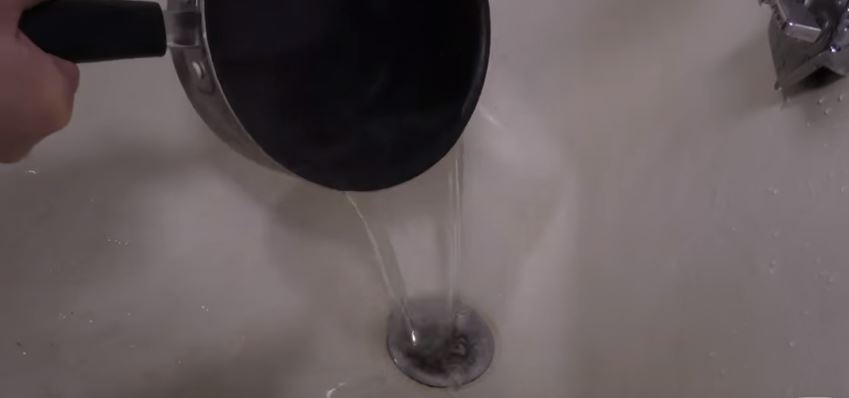
The height and width of the screenshot is (398, 849). I want to click on pot, so click(x=212, y=101).